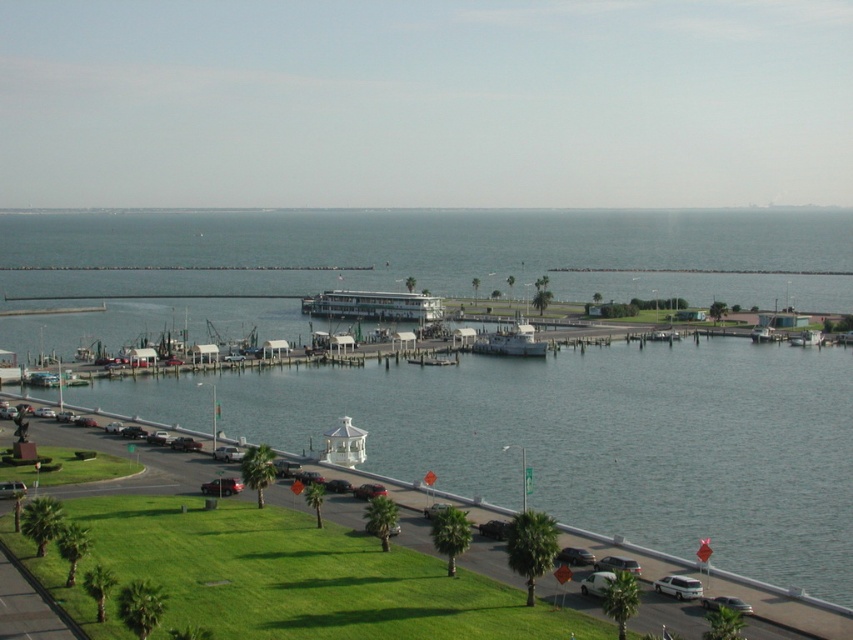
You are standing on the grassy area near the waterfront and want to cross the road to reach the parking lot on the other side. The metallic silver sedan at lower center is blocking your path. Can you estimate how far you need to walk to go around it safely?

The metallic silver sedan at lower center is 109.48 meters from viewer. To safely go around it, you should walk approximately 109.48 meters to reach the sedan and then detour around it, ensuring you stay within the designated pathways.

You are driving a car and want to avoid the water. Based on the scene, which direction should you steer your metallic silver sedan at center to stay on the road and avoid the clear blue water at center?

The clear blue water at center is in front of the metallic silver sedan at center, so you should steer away from the direction of the clear blue water at center to avoid it and stay on the road.